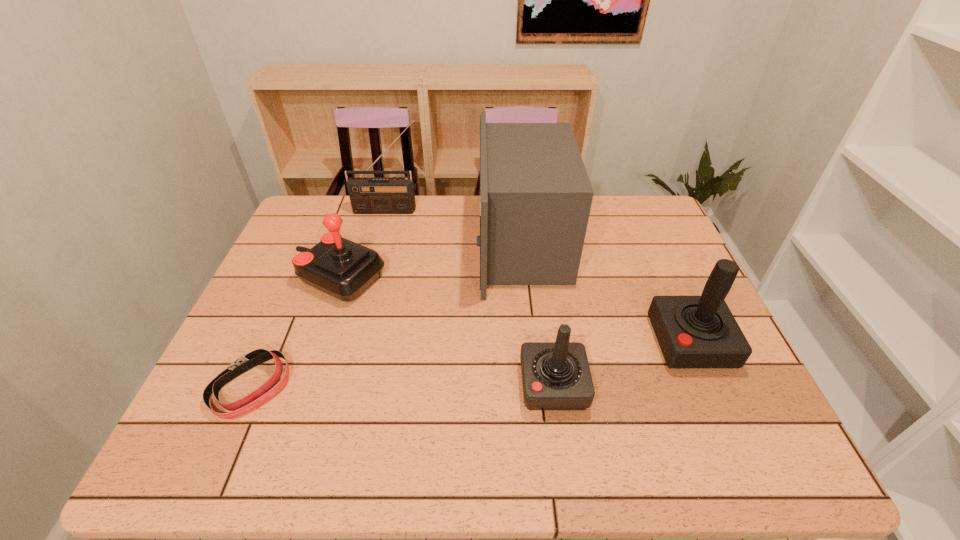
The width and height of the screenshot is (960, 540). What are the coordinates of `vacant space located 0.220m on the front-facing side of the radio receiver` in the screenshot? It's located at (375, 258).

Identify the location of vacant position located 0.310m on the base of the rightmost joystick. (526, 342).

Where is `free region located 0.160m on the base of the rightmost joystick`? This screenshot has width=960, height=540. free region located 0.160m on the base of the rightmost joystick is located at coordinates (588, 342).

At what (x,y) coordinates should I click in order to perform the action: click on free space located 0.370m on the base of the rightmost joystick. Please return your answer as a coordinate pair (x, y). Image resolution: width=960 pixels, height=540 pixels. Looking at the image, I should click on (502, 342).

Locate an element on the screen. free point located on the back of the leftmost joystick is located at coordinates (355, 230).

You are a GUI agent. You are given a task and a screenshot of the screen. Output one action in this format:
    pyautogui.click(x=<x>, y=<y>)
    Task: Click on the free space located 0.140m on the front-facing side of the shortest joystick
    
    Given the screenshot: What is the action you would take?
    pyautogui.click(x=458, y=385)

The height and width of the screenshot is (540, 960). What are the coordinates of `vacant space situated on the front-facing side of the shortest joystick` in the screenshot? It's located at (463, 385).

Where is `blank area located 0.350m on the front-facing side of the shortest joystick`? This screenshot has width=960, height=540. blank area located 0.350m on the front-facing side of the shortest joystick is located at coordinates (364, 385).

This screenshot has width=960, height=540. In order to click on vacant space located 0.360m on the back of the dog collar in this screenshot , I will do `click(307, 258)`.

This screenshot has height=540, width=960. I want to click on microwave oven present at the far edge, so click(x=535, y=195).